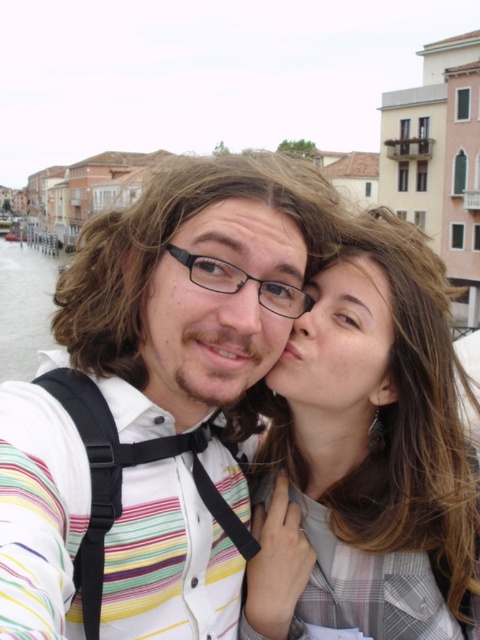
Looking at this image, does matte black glasses at center appear on the left side of black plastic glasses at center?

Yes, matte black glasses at center is to the left of black plastic glasses at center.

From the picture: Is matte black glasses at center wider than black plastic glasses at center?

Yes.

Which is behind, point (240, 256) or point (219, 285)?

Point (219, 285)

The height and width of the screenshot is (640, 480). I want to click on matte black glasses at center, so click(217, 307).

Is smooth brown hair at center above matte black glasses at center?

Incorrect, smooth brown hair at center is not positioned above matte black glasses at center.

Looking at this image, who is lower down, smooth brown hair at center or matte black glasses at center?

Positioned lower is smooth brown hair at center.

The image size is (480, 640). What are the coordinates of `smooth brown hair at center` in the screenshot? It's located at (367, 456).

Between smooth brown hair at center and black plastic glasses at center, which one is positioned higher?

black plastic glasses at center is above.

Measure the distance between point (x=380, y=380) and camera.

Point (x=380, y=380) is 130.94 feet from camera.

Does point (414, 353) come farther from viewer compared to point (170, 248)?

Yes, it is.

You are a GUI agent. You are given a task and a screenshot of the screen. Output one action in this format:
    pyautogui.click(x=<x>, y=<y>)
    Task: Click on the smooth brown hair at center
    
    Given the screenshot: What is the action you would take?
    pyautogui.click(x=367, y=456)